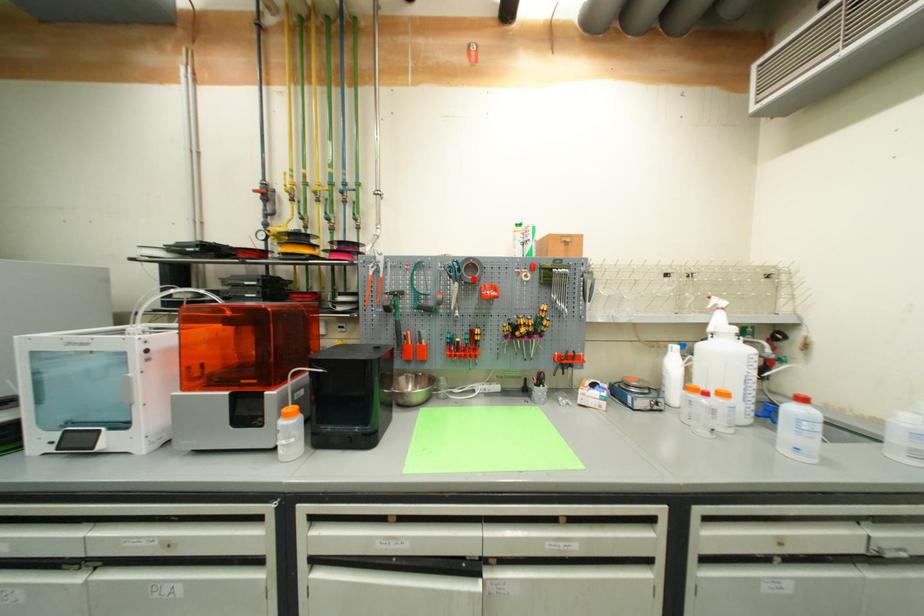
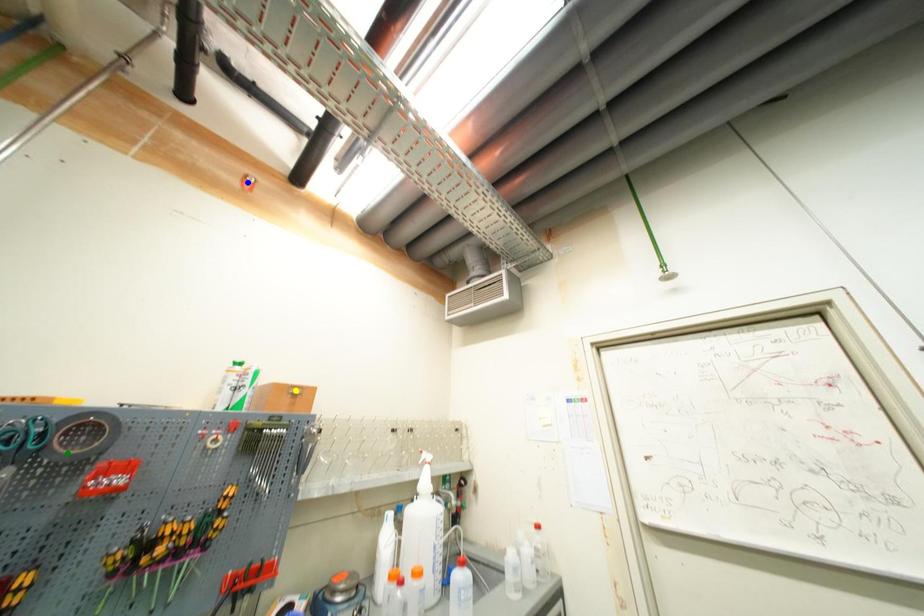
Question: I am providing you with two images of the same scene from different viewpoints. A red point is marked on the first image. You are given multiple points on the second image. In image 2, which mark is for the same physical point as the one in image 1?

Choices:
 (A) yellow point
 (B) green point
 (C) blue point

Answer: (B)